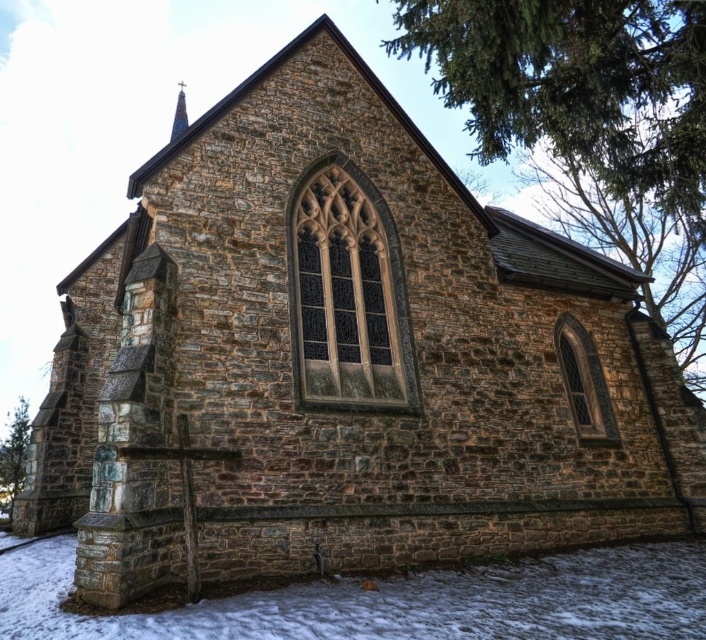
You are an architect planning to add a new window to the church. You want to place it in a spot where there is a green leafy tree at upper right and a green leafy tree at lower left. Which tree should you consider for better visibility, and why?

The green leafy tree at upper right is larger in size than the green leafy tree at lower left, so placing the window near the larger tree might offer better visibility due to its broader canopy providing more shade and aesthetic appeal.

You are standing in front of the church and want to know if the green leafy tree at upper right could block the view of the white powdery snow at lower center. Can you determine this based on their sizes?

The green leafy tree at upper right might be wider than white powdery snow at lower center, so it could potentially block the view depending on their exact positions and angles.

You are standing in front of the church and want to take a photo that includes both the green leafy tree at upper right and the white powdery snow at lower center. Which object will appear bigger in the photo?

The green leafy tree at upper right will appear bigger in the photo because it is larger in size than the white powdery snow at lower center.